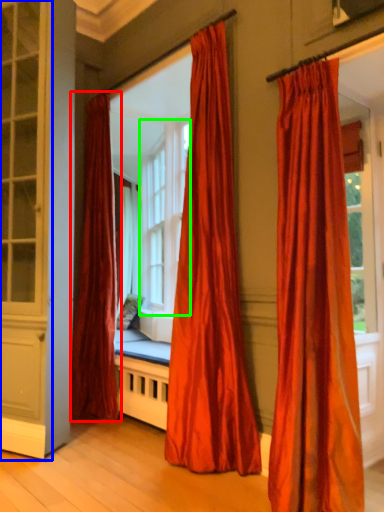
Question: Based on their relative distances, which object is nearer to curtain (highlighted by a red box)? Choose from screen door (highlighted by a blue box) and bay window (highlighted by a green box).

Choices:
 (A) screen door
 (B) bay window

Answer: (A)